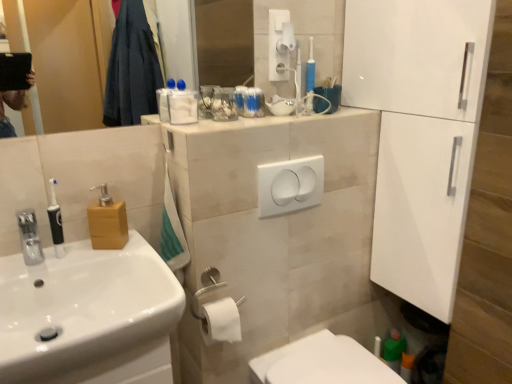
Find the location of `vacant area on top of beige tile counter at upper center (from a real-world perspective)`. vacant area on top of beige tile counter at upper center (from a real-world perspective) is located at coordinates (269, 111).